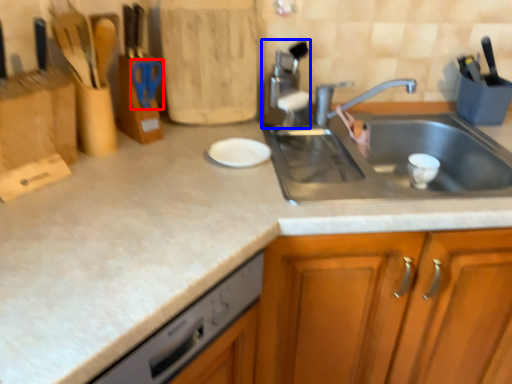
Question: Which object appears farthest to the camera in this image, scissors (highlighted by a red box) or appliance (highlighted by a blue box)?

Choices:
 (A) scissors
 (B) appliance

Answer: (B)